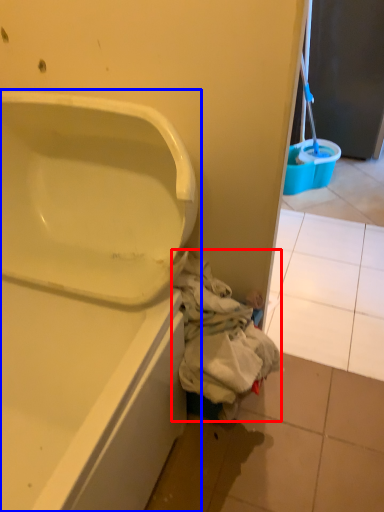
Question: Among these objects, which one is farthest to the camera, garbage (highlighted by a red box) or bathtub (highlighted by a blue box)?

Choices:
 (A) garbage
 (B) bathtub

Answer: (A)